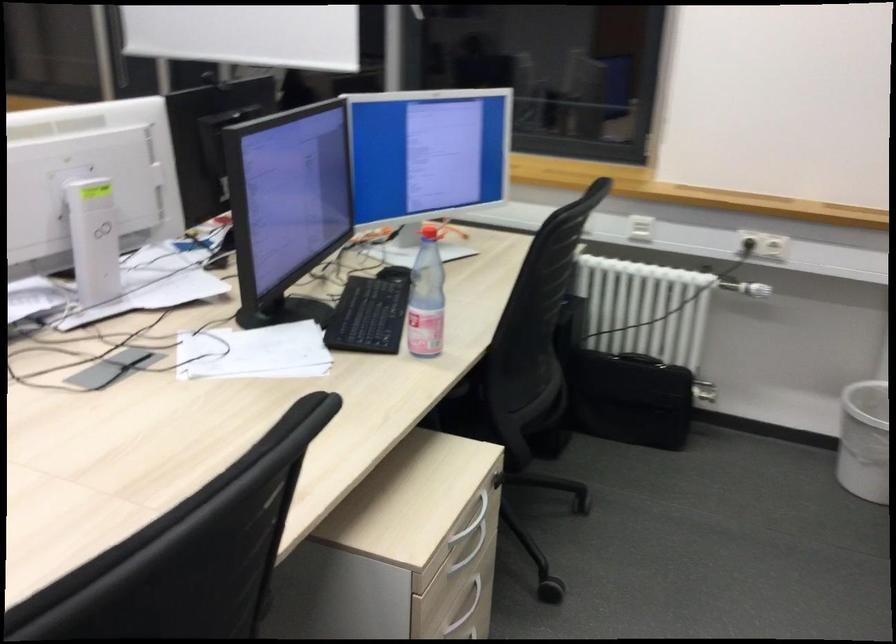
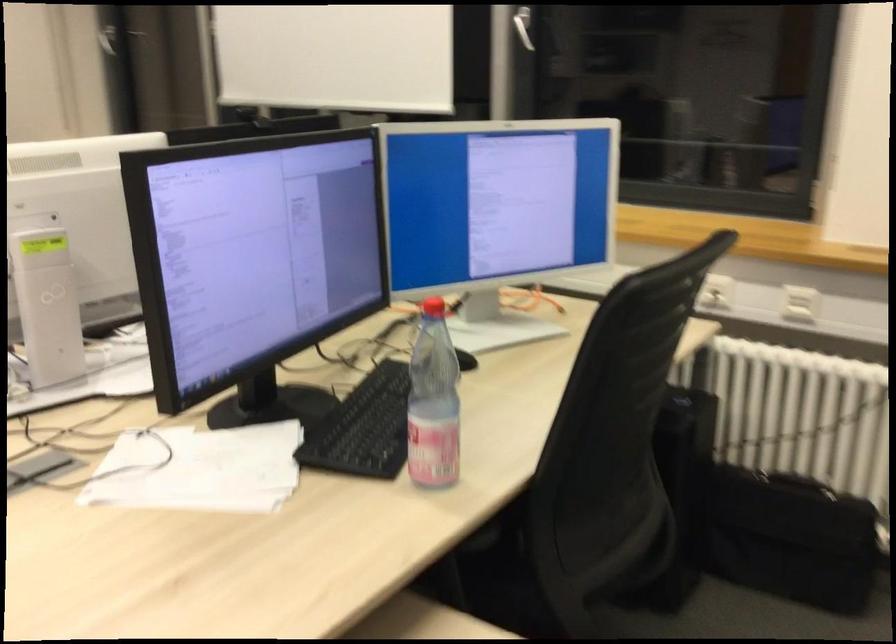
Question: The camera is either moving clockwise (left) or counter-clockwise (right) around the object. The first image is from the beginning of the video and the second image is from the end. Is the camera moving left or right when shooting the video?

Choices:
 (A) Left
 (B) Right

Answer: (B)